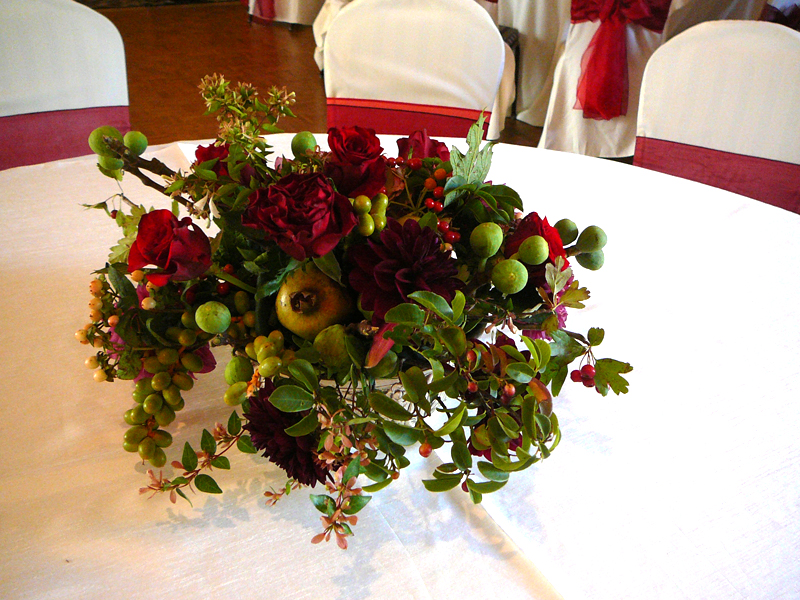
Where is `table cloth`? table cloth is located at coordinates (710, 461).